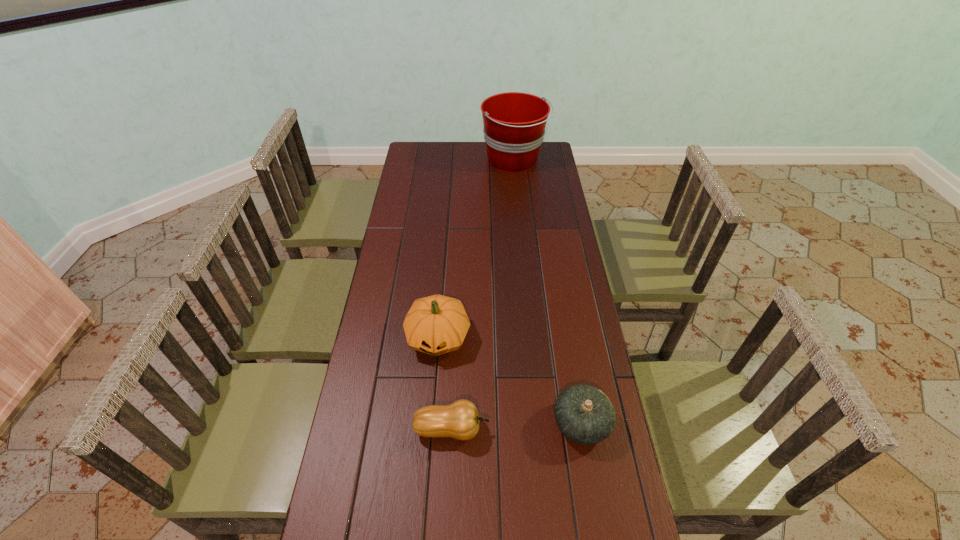
Locate which object is the second closest to the shortest gourd. Please provide its 2D coordinates. Your answer should be formatted as a tuple, i.e. [(x, y)], where the tuple contains the x and y coordinates of a point satisfying the conditions above.

[(584, 414)]

Select which gourd is the second closest to the rightmost gourd. Please provide its 2D coordinates. Your answer should be formatted as a tuple, i.e. [(x, y)], where the tuple contains the x and y coordinates of a point satisfying the conditions above.

[(437, 324)]

Find the location of `gourd that can be found as the closest to the shortest gourd`. gourd that can be found as the closest to the shortest gourd is located at coordinates (437, 324).

This screenshot has width=960, height=540. In order to click on free space that satisfies the following two spatial constraints: 1. on the front side of the rightmost gourd; 2. on the right side of the tallest object in this screenshot , I will do `click(540, 423)`.

You are a GUI agent. You are given a task and a screenshot of the screen. Output one action in this format:
    pyautogui.click(x=<x>, y=<y>)
    Task: Click on the vacant space that satisfies the following two spatial constraints: 1. on the side of the farthest gourd with the carved face; 2. on the left side of the rightmost gourd
    The height and width of the screenshot is (540, 960).
    Given the screenshot: What is the action you would take?
    pyautogui.click(x=431, y=423)

Identify the location of vacant area in the image that satisfies the following two spatial constraints: 1. on the front side of the second shortest gourd; 2. on the stem side of the shortest object. This screenshot has height=540, width=960. (583, 429).